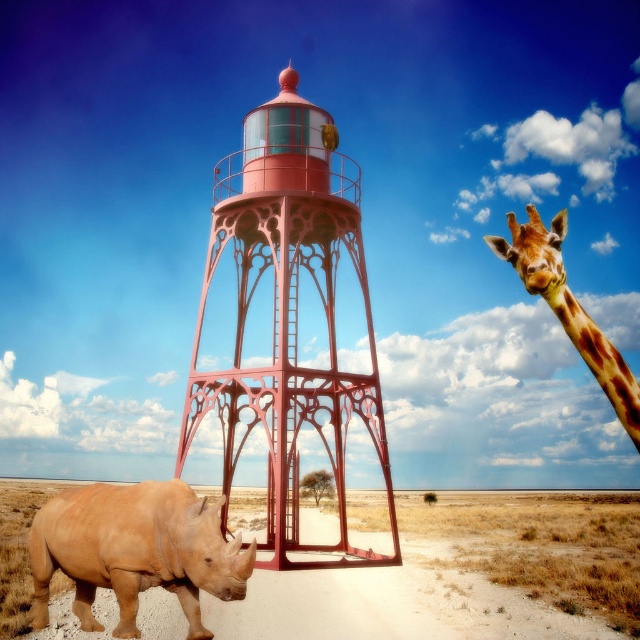
Does point (282, 154) come behind point (492, 248)?

That is True.

Does metallic pink tower at center have a greater height compared to spotted fur giraffe at upper right?

Indeed, metallic pink tower at center has a greater height compared to spotted fur giraffe at upper right.

At what (x,y) coordinates should I click in order to perform the action: click on metallic pink tower at center. Please return your answer as a coordinate pair (x, y). The image size is (640, 640). Looking at the image, I should click on (289, 314).

Who is shorter, metallic pink tower at center or light brown matte rhinoceros at lower left?

light brown matte rhinoceros at lower left

In the scene shown: Is metallic pink tower at center above light brown matte rhinoceros at lower left?

Correct, metallic pink tower at center is located above light brown matte rhinoceros at lower left.

Between point (282, 349) and point (177, 506), which one is positioned behind?

The point (282, 349) is behind.

This screenshot has height=640, width=640. I want to click on metallic pink tower at center, so click(x=289, y=314).

Is light brown matte rhinoceros at lower left thinner than spotted fur giraffe at upper right?

Indeed, light brown matte rhinoceros at lower left has a lesser width compared to spotted fur giraffe at upper right.

The height and width of the screenshot is (640, 640). What do you see at coordinates (134, 550) in the screenshot? I see `light brown matte rhinoceros at lower left` at bounding box center [134, 550].

Does point (122, 592) come closer to viewer compared to point (570, 292)?

That is True.

Where is `light brown matte rhinoceros at lower left`? light brown matte rhinoceros at lower left is located at coordinates (134, 550).